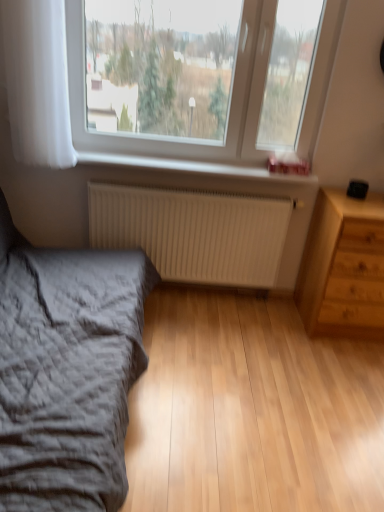
Question: Is point (160, 215) positioned closer to the camera than point (236, 177)?

Choices:
 (A) closer
 (B) farther

Answer: (B)

Question: Is white matte radiator at lower center taller or shorter than white plastic radiator at lower center?

Choices:
 (A) tall
 (B) short

Answer: (A)

Question: Which of these objects is positioned farthest from the white matte radiator at lower center?

Choices:
 (A) white plastic radiator at lower center
 (B) transparent glass window at upper center
 (C) white sheer curtain at left
 (D) light brown wood chest of drawers at right
 (E) gray textured bed at lower left

Answer: (E)

Question: Which object is the closest to the white plastic radiator at lower center?

Choices:
 (A) gray textured bed at lower left
 (B) white sheer curtain at left
 (C) light brown wood chest of drawers at right
 (D) transparent glass window at upper center
 (E) white matte radiator at lower center

Answer: (D)